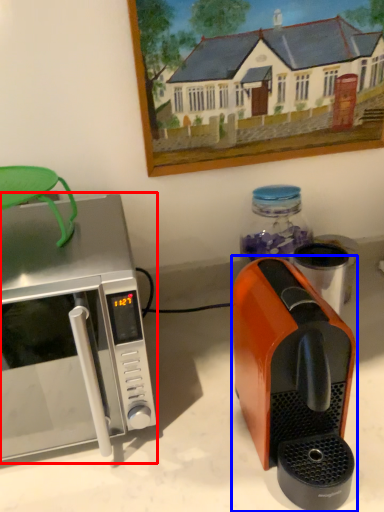
Question: Which object appears closest to the camera in this image, microwave oven (highlighted by a red box) or coffee maker (highlighted by a blue box)?

Choices:
 (A) microwave oven
 (B) coffee maker

Answer: (B)